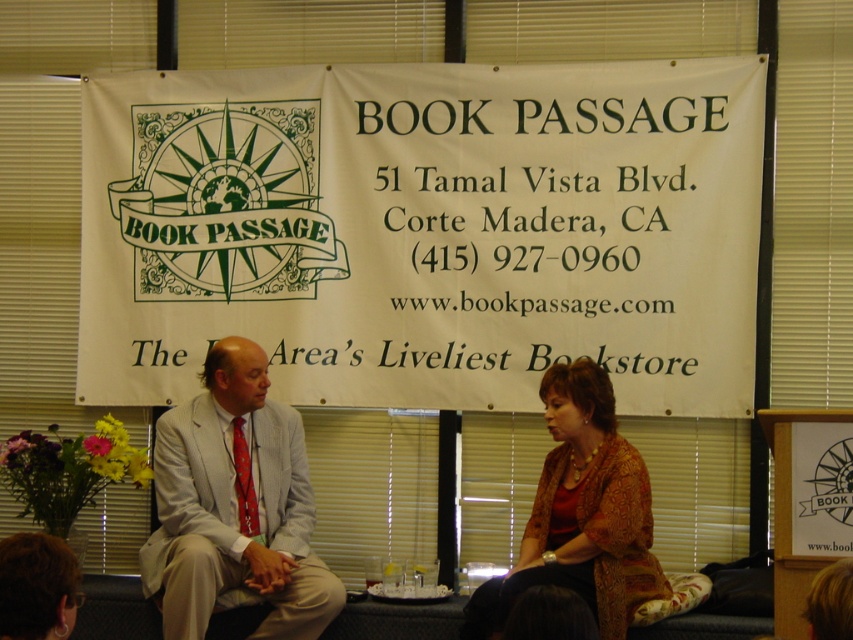
Question: Is light gray suit at center to the right of brown textured sweater at center from the viewer's perspective?

Choices:
 (A) no
 (B) yes

Answer: (A)

Question: Which of these objects is positioned closest to the brown textured sweater at center?

Choices:
 (A) light gray suit at center
 (B) white paper banner at upper center

Answer: (A)

Question: Can you confirm if white paper banner at upper center is smaller than light gray suit at center?

Choices:
 (A) no
 (B) yes

Answer: (A)

Question: Where is white paper banner at upper center located in relation to light gray suit at center in the image?

Choices:
 (A) left
 (B) right

Answer: (B)

Question: Estimate the real-world distances between objects in this image. Which object is farther from the white paper banner at upper center?

Choices:
 (A) brown textured sweater at center
 (B) light gray suit at center

Answer: (A)

Question: Which is nearer to the brown textured sweater at center?

Choices:
 (A) light gray suit at center
 (B) white paper banner at upper center

Answer: (A)